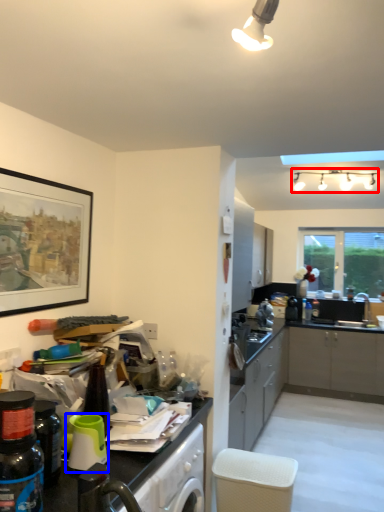
Question: Which point is closer to the camera, light fixture (highlighted by a red box) or appliance (highlighted by a blue box)?

Choices:
 (A) light fixture
 (B) appliance

Answer: (B)